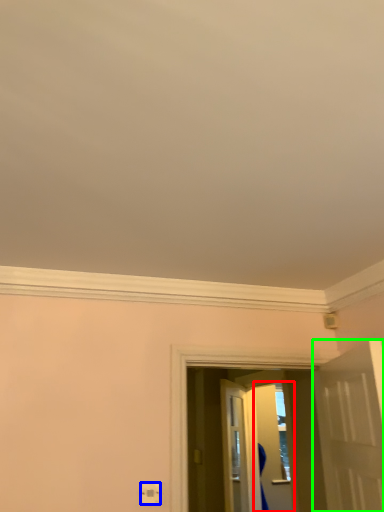
Question: Which object is positioned farthest from screen door (highlighted by a red box)? Select from electric outlet (highlighted by a blue box) and door (highlighted by a green box).

Choices:
 (A) electric outlet
 (B) door

Answer: (A)